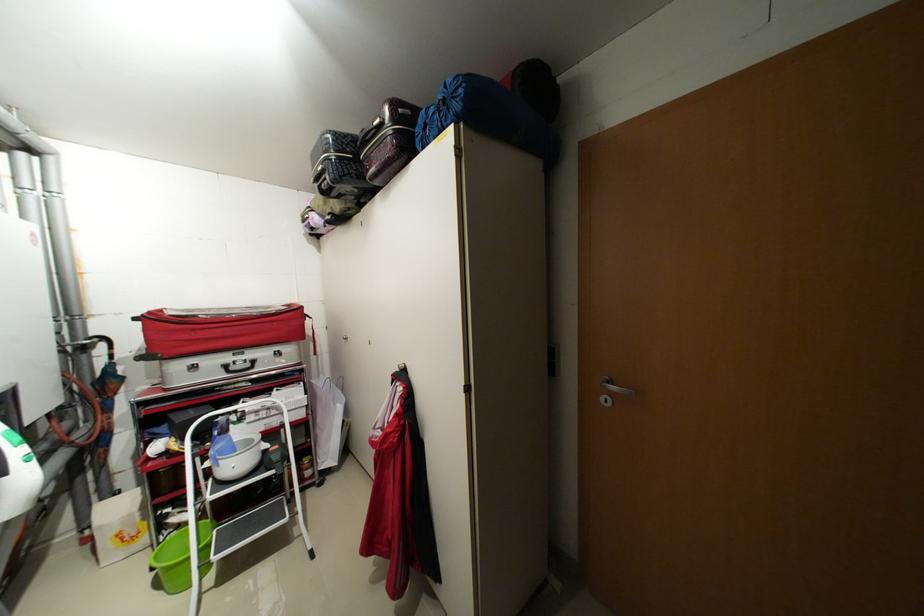
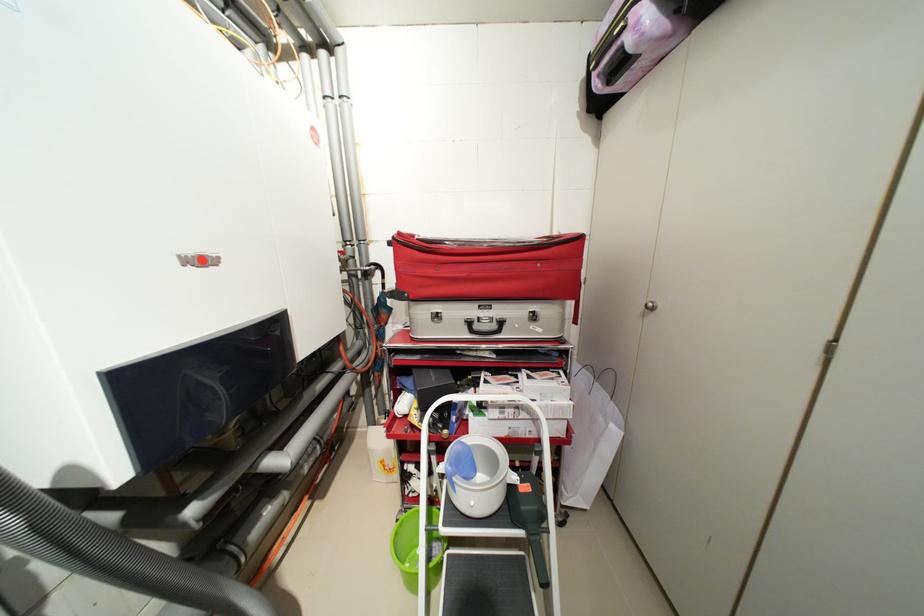
Where in the second image is the point corresponding to point 157,314 from the first image?

(407, 235)